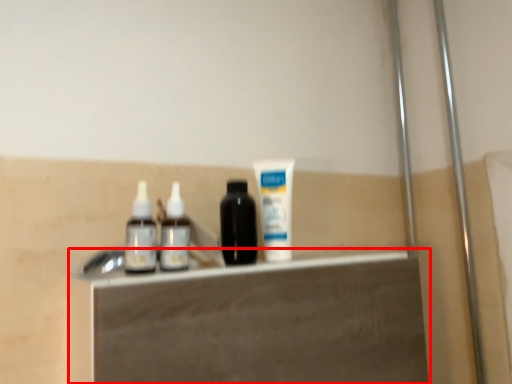
Question: Observing the image, what is the correct spatial positioning of vanity (annotated by the red box) in reference to toothpaste?

Choices:
 (A) left
 (B) right

Answer: (A)